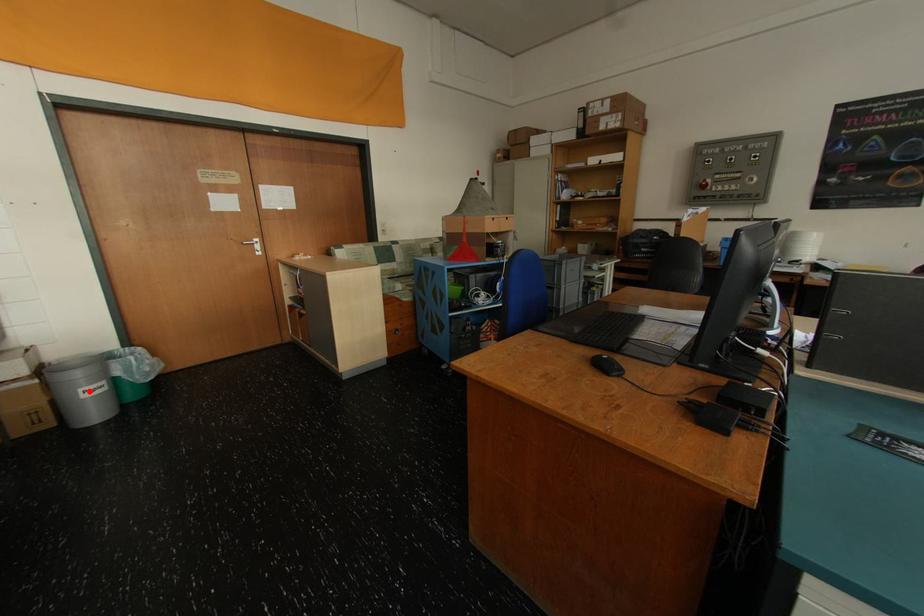
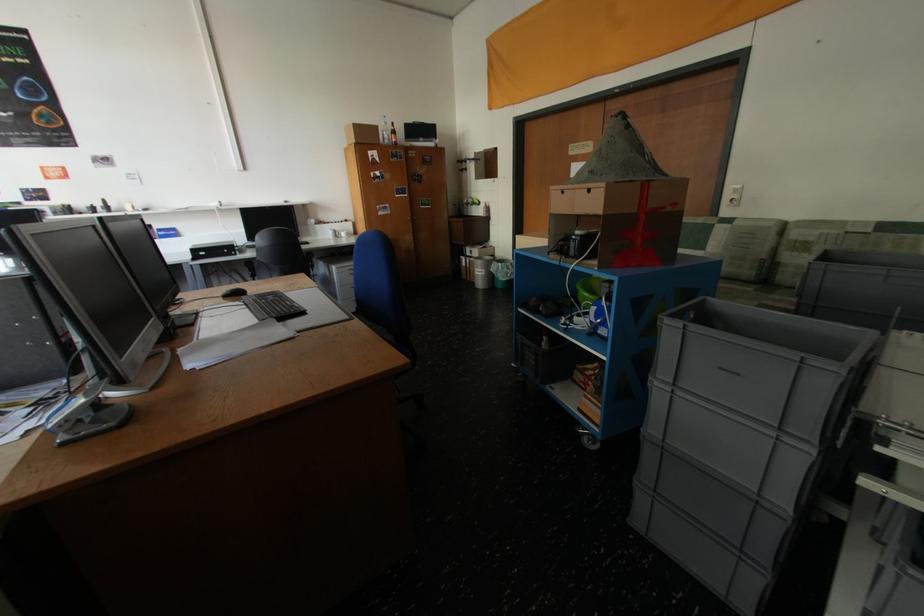
Locate, in the second image, the point that corresponds to the highlighted location in the first image.

(484, 270)